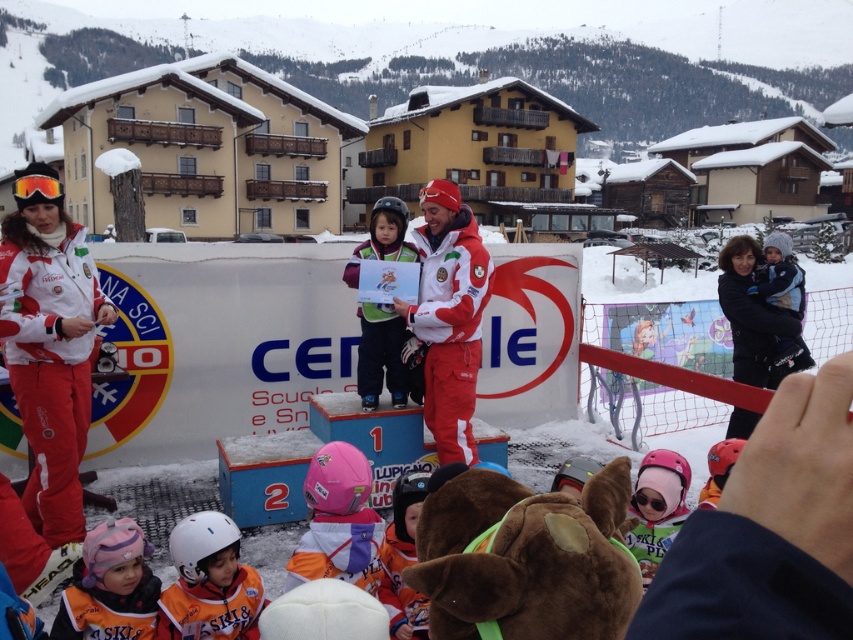
You are a photographer at the event and need to adjust your camera to capture both the orange ski suit at lower left and the pink matte helmet at center in the same frame. Considering their heights, which object should you focus on first to ensure both are in focus?

The orange ski suit at lower left has a lesser height compared to the pink matte helmet at center, so you should focus on the pink matte helmet at center first to ensure both are in focus.

You are a photographer trying to capture a closeup of the orange ski suit at lower left and the pink matte helmet at center. Which object should you zoom in on first to ensure it fits within your camera frame?

The orange ski suit at lower left occupies less space than the pink matte helmet at center, so you should zoom in on the orange ski suit at lower left first to ensure it fits within your camera frame before adjusting for the larger pink matte helmet at center.

In the scene shown: You are a photographer positioned at the center of the scene. You want to take a photo of the matte red jacket at center. Which direction should you move to get the best shot?

Since the matte red jacket at center is already at the center of the scene, you don not need to move. You can take the photo from your current position.